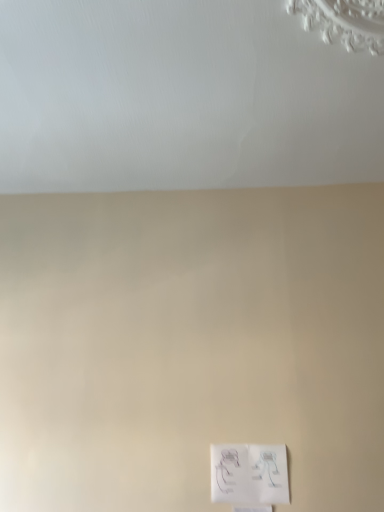
Question: In terms of width, does white matte ceiling at upper center look wider or thinner when compared to white paper at lower center?

Choices:
 (A) thin
 (B) wide

Answer: (B)

Question: Would you say white matte ceiling at upper center is inside or outside white paper at lower center?

Choices:
 (A) inside
 (B) outside

Answer: (B)

Question: Considering their positions, is white matte ceiling at upper center located in front of or behind white paper at lower center?

Choices:
 (A) front
 (B) behind

Answer: (A)

Question: Would you say white paper at lower center is to the left or to the right of white matte ceiling at upper center in the picture?

Choices:
 (A) left
 (B) right

Answer: (B)

Question: In terms of height, does white paper at lower center look taller or shorter compared to white matte ceiling at upper center?

Choices:
 (A) short
 (B) tall

Answer: (B)

Question: Considering the positions of white paper at lower center and white matte ceiling at upper center in the image, is white paper at lower center wider or thinner than white matte ceiling at upper center?

Choices:
 (A) wide
 (B) thin

Answer: (B)

Question: Considering their positions, is white paper at lower center located in front of or behind white matte ceiling at upper center?

Choices:
 (A) front
 (B) behind

Answer: (B)